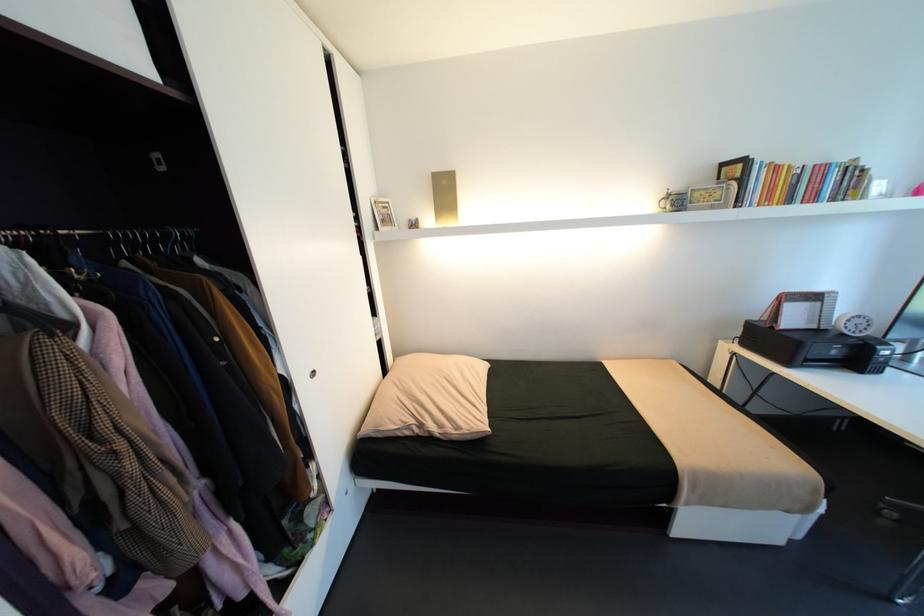
Where is `tan pillow`? The image size is (924, 616). tan pillow is located at coordinates (430, 399).